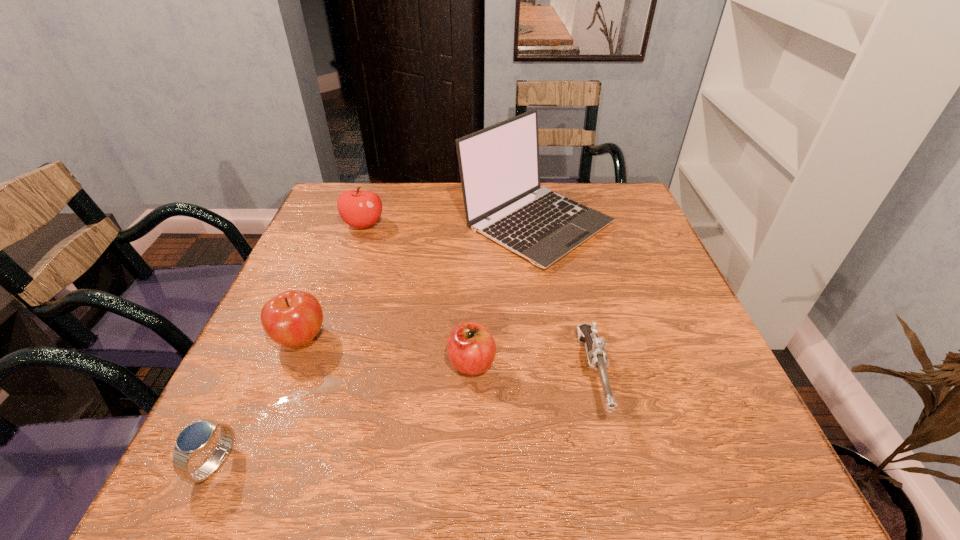
I want to click on vacant space that is in between the shortest apple and the tallest object, so click(504, 293).

The height and width of the screenshot is (540, 960). I want to click on vacant area between the farthest apple and the tallest object, so click(x=449, y=224).

Identify which object is located as the nearest to the farthest apple. Please provide its 2D coordinates. Your answer should be formatted as a tuple, i.e. [(x, y)], where the tuple contains the x and y coordinates of a point satisfying the conditions above.

[(499, 167)]

At what (x,y) coordinates should I click in order to perform the action: click on object that stands as the fourth closest to the nearest object. Please return your answer as a coordinate pair (x, y). The image size is (960, 540). Looking at the image, I should click on (360, 209).

Find the location of a particular element. The image size is (960, 540). apple that stands as the second closest to the tallest object is located at coordinates (471, 349).

The height and width of the screenshot is (540, 960). I want to click on apple that is the third closest one to the nearest object, so click(360, 209).

This screenshot has width=960, height=540. Identify the location of vacant position in the image that satisfies the following two spatial constraints: 1. on the back side of the farthest apple; 2. on the right side of the nearest object. (325, 224).

Locate an element on the screen. The height and width of the screenshot is (540, 960). vacant region that satisfies the following two spatial constraints: 1. on the front side of the farthest apple; 2. on the left side of the shortest apple is located at coordinates (316, 362).